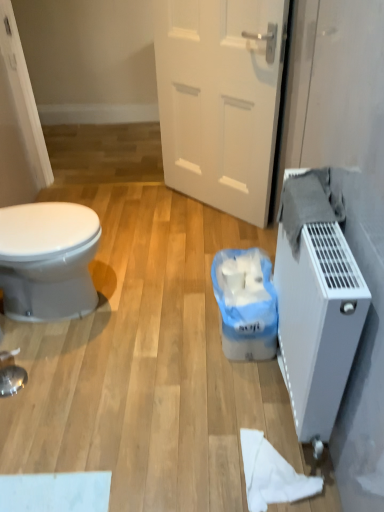
The height and width of the screenshot is (512, 384). I want to click on vacant space to the left of white plastic bag at lower center, so click(173, 330).